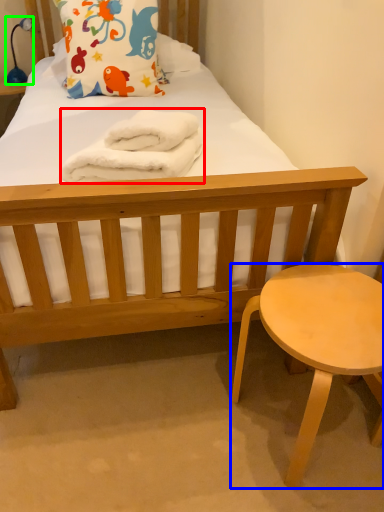
Question: Estimate the real-world distances between objects in this image. Which object is closer to material (highlighted by a red box), stool (highlighted by a blue box) or lamp (highlighted by a green box)?

Choices:
 (A) stool
 (B) lamp

Answer: (A)